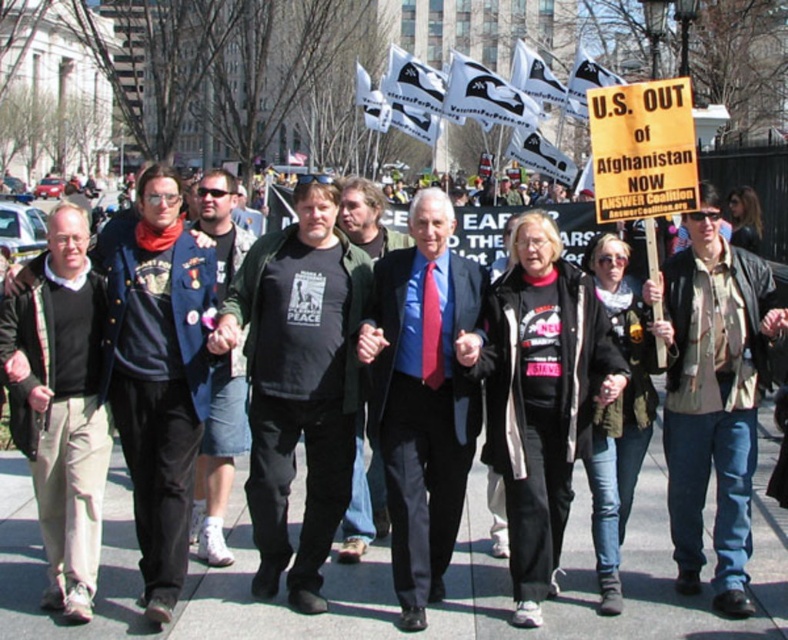
Is gray concrete sidewalk at center below dark blue jacket at left?

Indeed, gray concrete sidewalk at center is positioned under dark blue jacket at left.

Is gray concrete sidewalk at center to the left of dark blue jacket at left from the viewer's perspective?

Incorrect, gray concrete sidewalk at center is not on the left side of dark blue jacket at left.

Between point (220, 616) and point (212, 260), which one is positioned behind?

The point (212, 260) is behind.

The height and width of the screenshot is (640, 788). In order to click on gray concrete sidewalk at center in this screenshot , I will do `click(497, 586)`.

Is dark blue jacket at left smaller than denim shorts at center?

Actually, dark blue jacket at left might be larger than denim shorts at center.

Measure the distance between point (188, 275) and camera.

Point (188, 275) is 5.78 meters away from camera.

Find the location of a particular element. Image resolution: width=788 pixels, height=640 pixels. dark blue jacket at left is located at coordinates (160, 376).

Can you confirm if khaki cotton jacket at center is bigger than blue fabric jacket at center?

Correct, khaki cotton jacket at center is larger in size than blue fabric jacket at center.

Who is more distant from viewer, (677, 552) or (374, 465)?

The point (374, 465) is behind.

Where is `khaki cotton jacket at center`? This screenshot has height=640, width=788. khaki cotton jacket at center is located at coordinates (714, 397).